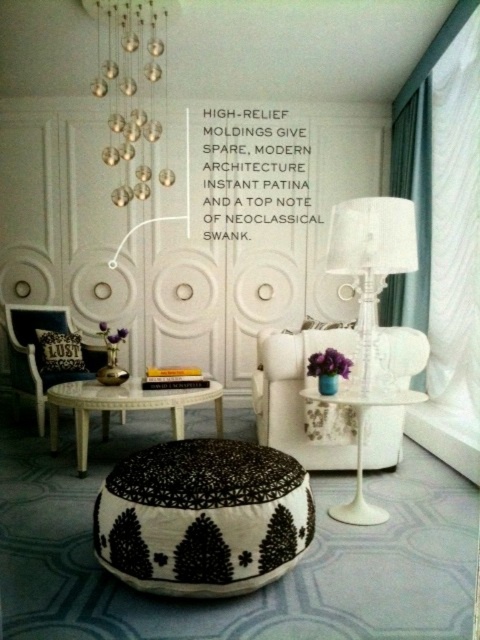
Question: Which point is closer to the camera?

Choices:
 (A) (38, 355)
 (B) (81, 390)

Answer: (B)

Question: Is white paper at upper center thinner than dark green fabric curtain at right?

Choices:
 (A) no
 (B) yes

Answer: (A)

Question: Which is farther from the black printed fabric ottoman at center?

Choices:
 (A) white fabric armchair at left
 (B) white paper at upper center

Answer: (B)

Question: Is white paper at upper center further to camera compared to dark green fabric curtain at right?

Choices:
 (A) no
 (B) yes

Answer: (B)

Question: Which object is positioned farthest from the black fabric pillow at lower left?

Choices:
 (A) white glossy side table at lower center
 (B) white paper at upper center

Answer: (A)

Question: From the image, what is the correct spatial relationship of clear glass lamp at right in relation to black fabric pillow at lower left?

Choices:
 (A) above
 (B) below

Answer: (A)